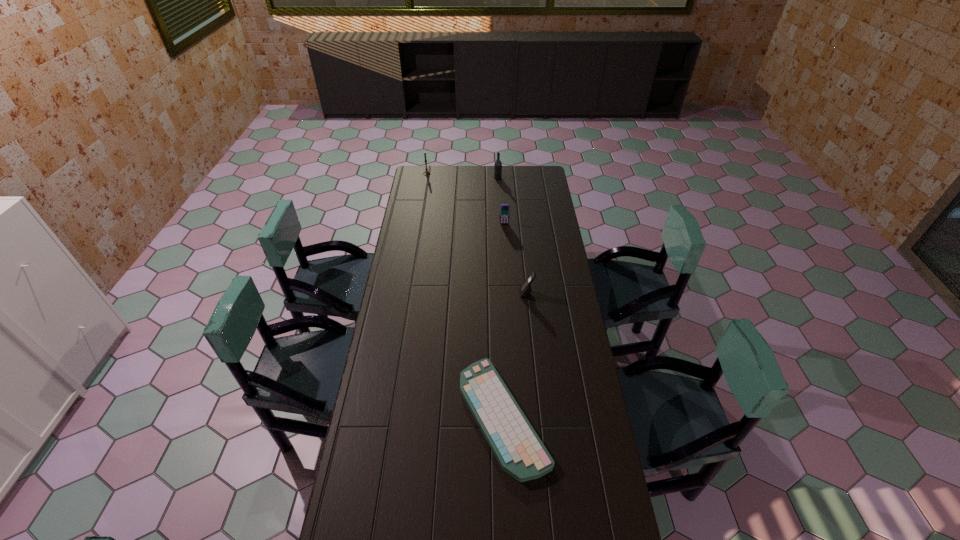
In the image, there is a desktop. Where is `vacant space at the far edge`? The height and width of the screenshot is (540, 960). vacant space at the far edge is located at coordinates (517, 183).

In the image, there is a desktop. Identify the location of vacant space at the left edge. (422, 241).

In the image, there is a desktop. Where is `vacant space at the right edge`? The image size is (960, 540). vacant space at the right edge is located at coordinates (543, 230).

At what (x,y) coordinates should I click in order to perform the action: click on free spot between the third nearest object and the vodka. Please return your answer as a coordinate pair (x, y). Looking at the image, I should click on (501, 201).

This screenshot has width=960, height=540. I want to click on unoccupied area between the fourth nearest object and the left cellular telephone, so click(x=501, y=201).

I want to click on vacant area that lies between the second farthest object and the farther cellular telephone, so click(x=501, y=201).

Image resolution: width=960 pixels, height=540 pixels. I want to click on free space between the second nearest object and the leftmost object, so click(x=477, y=233).

Where is `vacant area that lies between the vodka and the farthest object`? The image size is (960, 540). vacant area that lies between the vodka and the farthest object is located at coordinates (463, 176).

Locate an element on the screen. vacant area that lies between the third farthest object and the vodka is located at coordinates (501, 201).

This screenshot has height=540, width=960. Identify the location of free spot between the farthest object and the right cellular telephone. (477, 233).